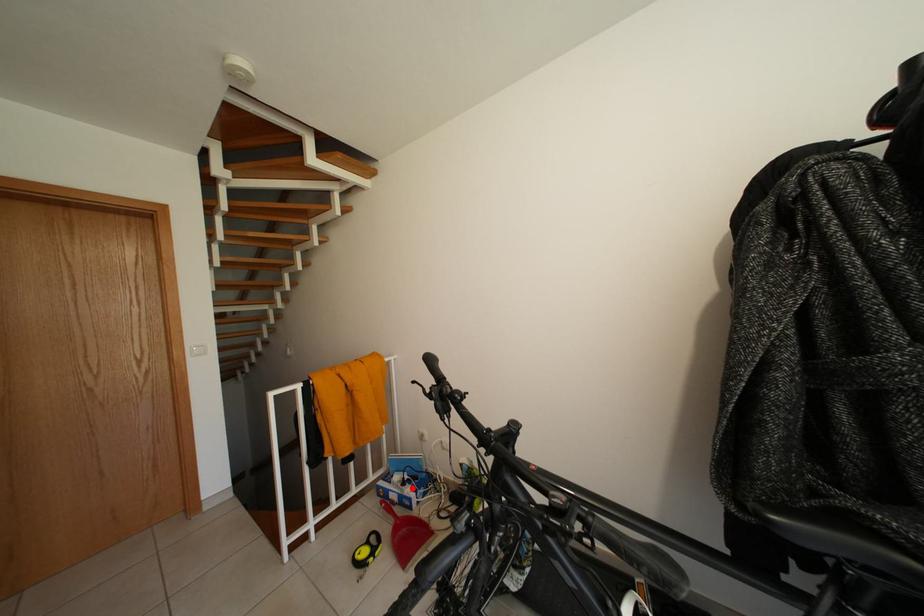
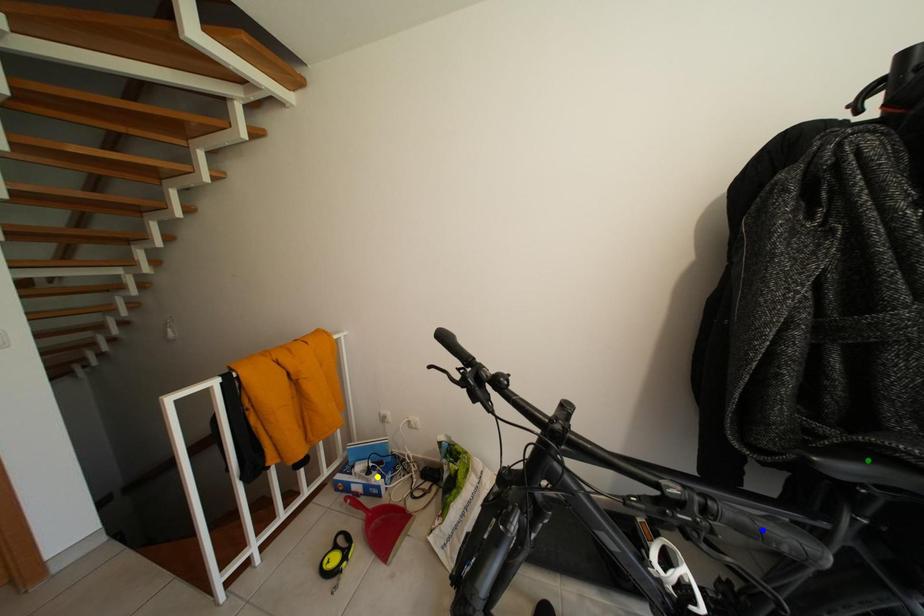
Question: I am providing you with two images of the same scene from different viewpoints. A red point is marked on the first image. You are given multiple points on the second image. Which mark in image 2 goes with the point in image 1?

Choices:
 (A) green point
 (B) yellow point
 (C) blue point

Answer: (B)